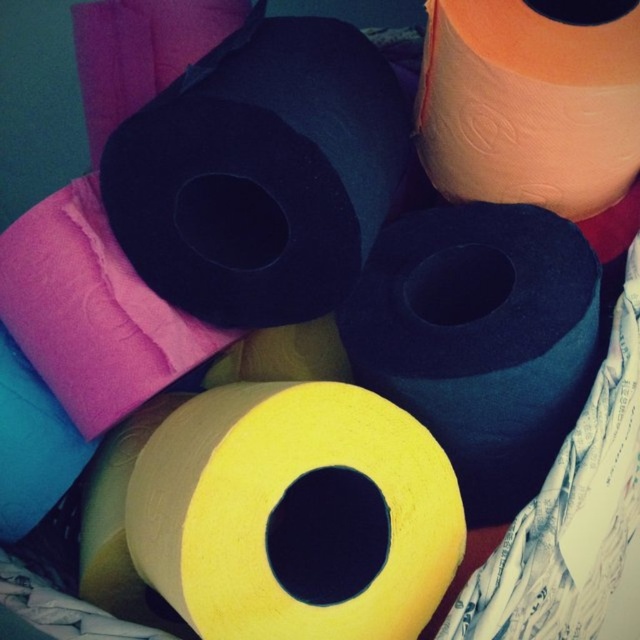
Question: Can you confirm if yellow matte paper towel at center is wider than matte pink pillow at upper left?

Choices:
 (A) no
 (B) yes

Answer: (B)

Question: Can you confirm if yellow matte paper towel at center is positioned to the right of matte pink pillow at upper left?

Choices:
 (A) no
 (B) yes

Answer: (B)

Question: Where is yellow matte paper towel at center located in relation to orange matte paper towel at upper right in the image?

Choices:
 (A) right
 (B) left

Answer: (B)

Question: Considering the real-world distances, which object is closest to the yellow matte paper towel at center?

Choices:
 (A) matte pink pillow at upper left
 (B) orange matte paper towel at upper right

Answer: (A)

Question: Which point is farther from the camera taking this photo?

Choices:
 (A) (200, 561)
 (B) (598, 84)
 (C) (177, 355)

Answer: (C)

Question: Which of the following is the closest to the observer?

Choices:
 (A) yellow matte paper towel at center
 (B) matte pink pillow at upper left

Answer: (A)